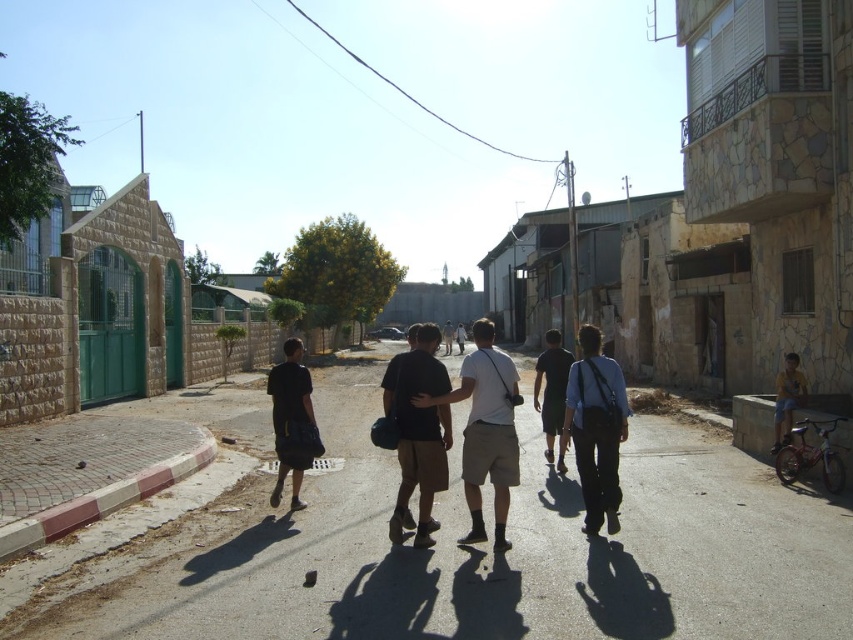
You are a tailor who needs to compare the sizes of two garments in the image. The black matte shorts at center and the yellow fabric shirt at lower right are both visible. Which garment has a greater width?

The black matte shorts at center has a greater width than the yellow fabric shirt at lower right according to the description.

You are a delivery person standing at the black matte shorts at center. You need to deliver a package to the yellow fabric shirt at lower right. The delivery robot you are using has a maximum range of 5 meters. Can you deliver the package without moving from your current position?

The black matte shorts at center and yellow fabric shirt at lower right are 6.64 meters apart from each other. Since the robot has a maximum range of 5 meters, you cannot deliver the package without moving from your current position.